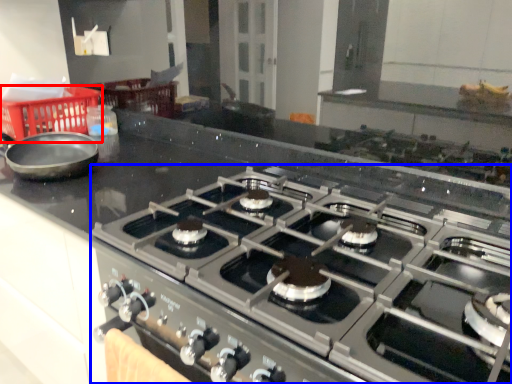
Question: Which of the following is the closest to the observer, basket (highlighted by a red box) or gas stove (highlighted by a blue box)?

Choices:
 (A) basket
 (B) gas stove

Answer: (B)